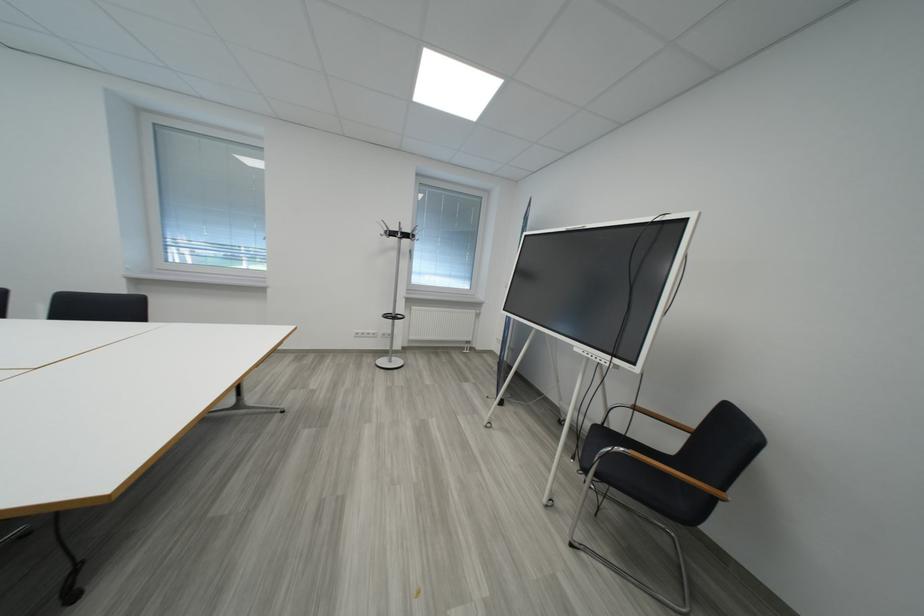
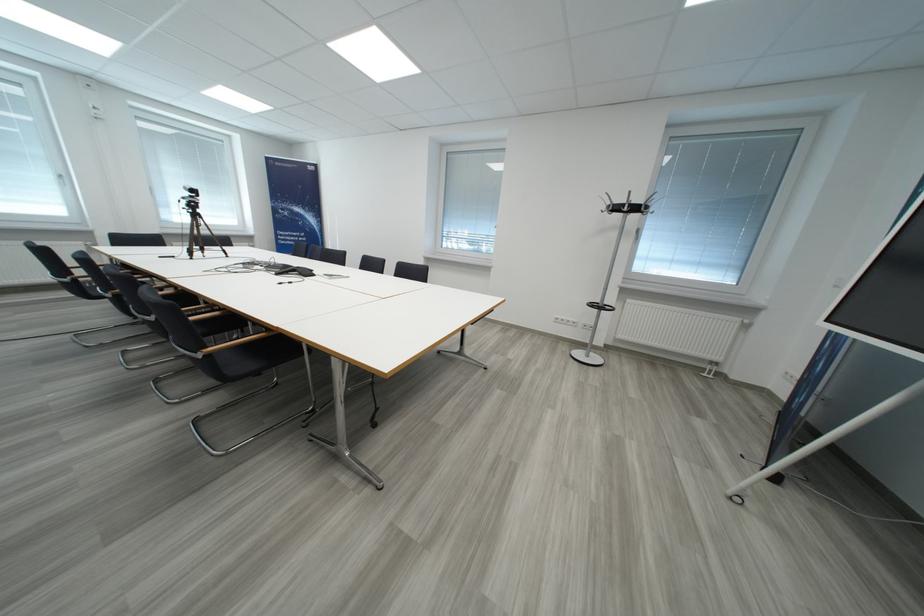
Question: The first image is from the beginning of the video and the second image is from the end. How did the camera likely rotate when shooting the video?

Choices:
 (A) Left
 (B) Right
 (C) Up
 (D) Down

Answer: (A)